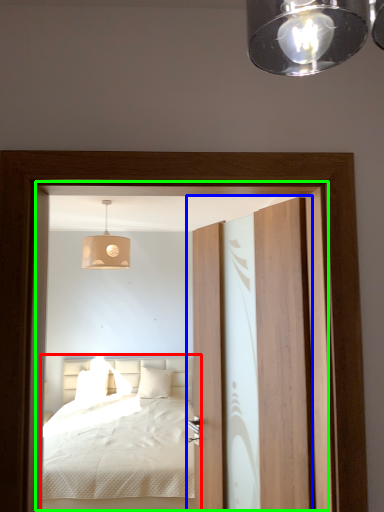
Question: Based on their relative distances, which object is farther from bed (highlighted by a red box)? Choose from door (highlighted by a blue box) and screen door (highlighted by a green box).

Choices:
 (A) door
 (B) screen door

Answer: (A)